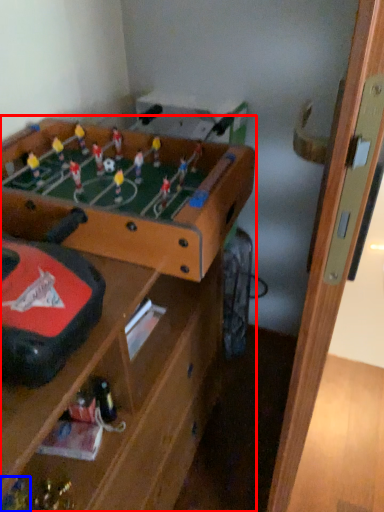
Question: Which object appears closest to the camera in this image, table (highlighted by a red box) or toy (highlighted by a blue box)?

Choices:
 (A) table
 (B) toy

Answer: (A)